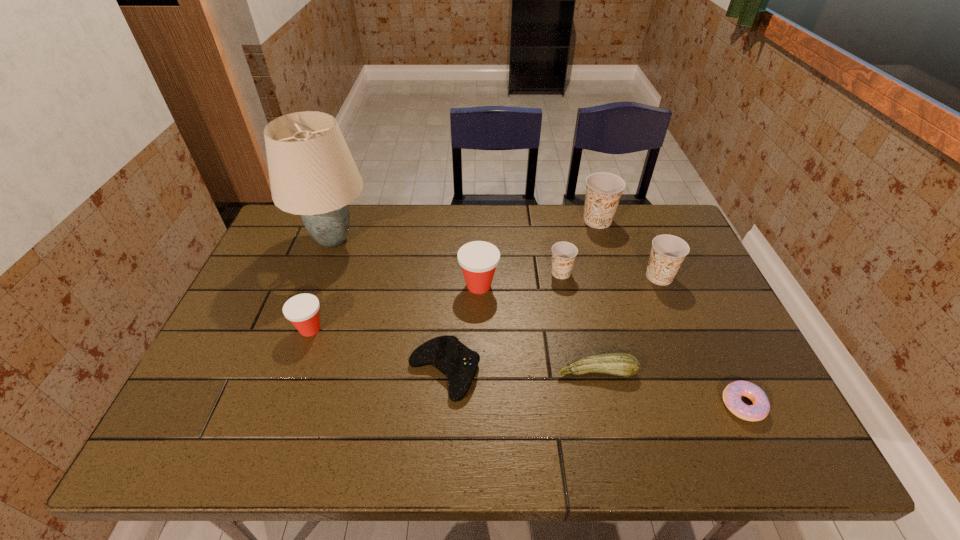
Select which object is the sixth closest to the third Dixie cup from right to left. Please provide its 2D coordinates. Your answer should be formatted as a tuple, i.e. [(x, y)], where the tuple contains the x and y coordinates of a point satisfying the conditions above.

[(732, 394)]

Choose which Dixie cup is the nearest neighbor to the second biggest orange Dixie cup. Please provide its 2D coordinates. Your answer should be formatted as a tuple, i.e. [(x, y)], where the tuple contains the x and y coordinates of a point satisfying the conditions above.

[(603, 190)]

Select which Dixie cup is the closest to the tallest Dixie cup. Please provide its 2D coordinates. Your answer should be formatted as a tuple, i.e. [(x, y)], where the tuple contains the x and y coordinates of a point satisfying the conditions above.

[(668, 251)]

This screenshot has width=960, height=540. I want to click on the second closest orange Dixie cup to the zucchini, so click(x=563, y=253).

Find the location of a particular element. orange Dixie cup that is the closest to the fourth nearest object is located at coordinates click(x=563, y=253).

Identify the location of free point that satisfies the following two spatial constraints: 1. on the front side of the fourth Dixie cup from right to left; 2. on the right side of the tallest object. (316, 286).